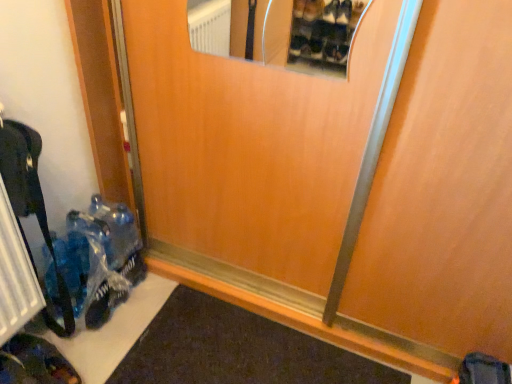
Question: From a real-world perspective, is dark brown leather shoe at lower left above or below translucent plastic bag at lower left?

Choices:
 (A) below
 (B) above

Answer: (A)

Question: Considering the positions of point (6, 357) and point (100, 309), is point (6, 357) closer or farther from the camera than point (100, 309)?

Choices:
 (A) farther
 (B) closer

Answer: (B)

Question: Which object is the farthest from the dark brown leather shoe at lower left?

Choices:
 (A) black metal radiator at lower left
 (B) translucent plastic bag at lower left
 (C) wooden door at center

Answer: (C)

Question: Which is nearer to the translucent plastic bag at lower left?

Choices:
 (A) black metal radiator at lower left
 (B) wooden door at center
 (C) dark brown leather shoe at lower left

Answer: (A)